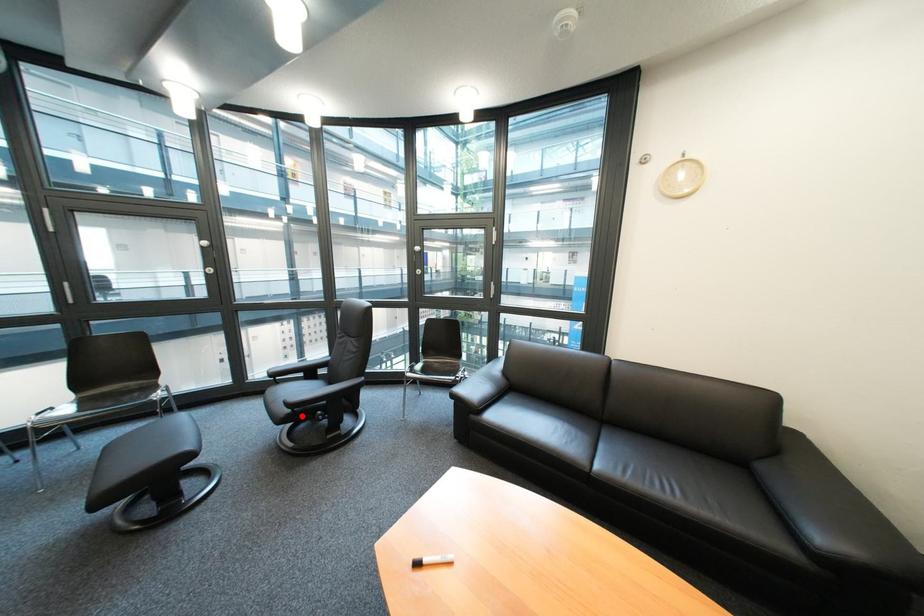
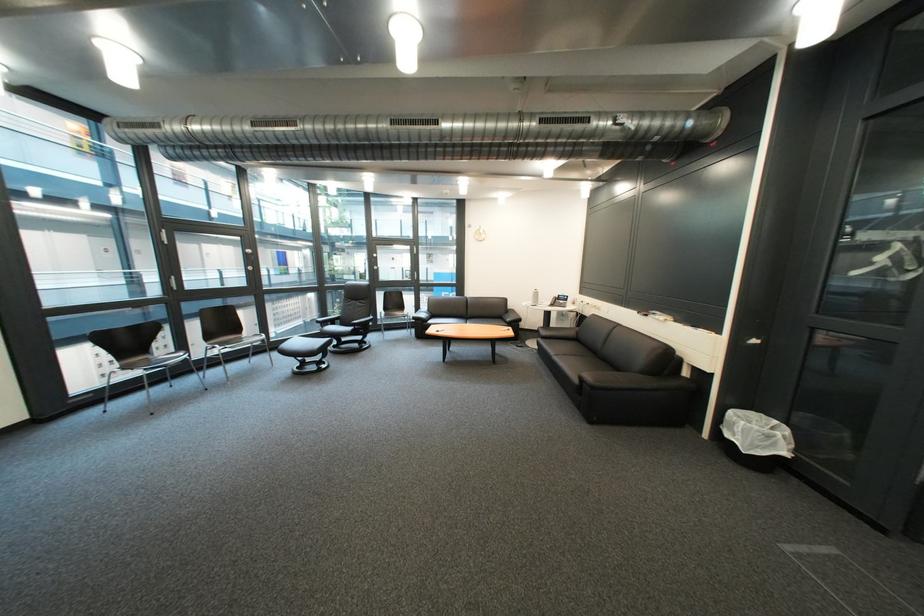
Find the pixel in the second image that matches the highlighted location in the first image.

(366, 331)